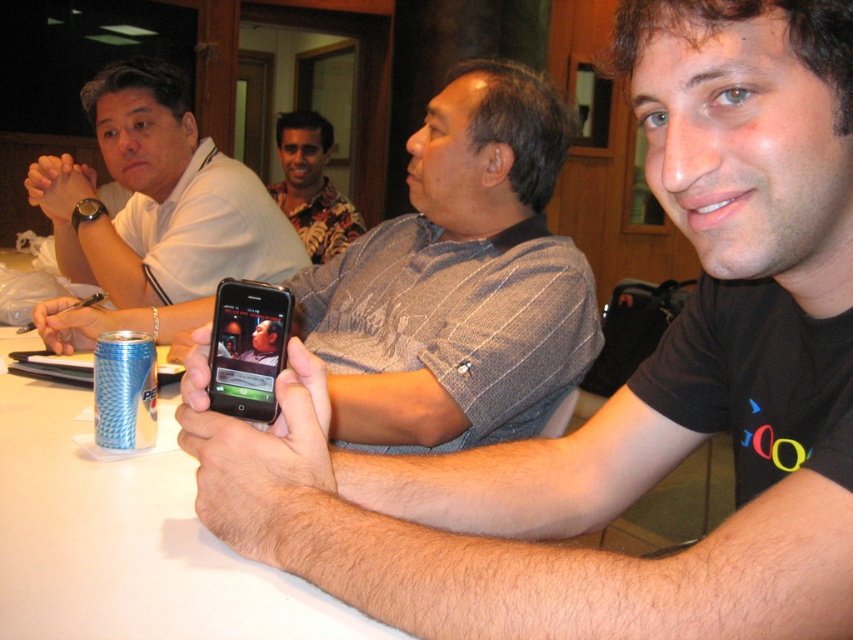
Question: Among these points, which one is farthest from the camera?

Choices:
 (A) (229, 355)
 (B) (148, 76)
 (C) (102, 384)
 (D) (422, 284)

Answer: (B)

Question: Can you confirm if matte black phone at center is positioned below floral shirt at center?

Choices:
 (A) yes
 (B) no

Answer: (A)

Question: Which of the following is the farthest from the observer?

Choices:
 (A) white matte shirt at upper left
 (B) matte black phone at center
 (C) floral shirt at center

Answer: (C)

Question: Is matte black phone at center above black glossy smartphone at center?

Choices:
 (A) yes
 (B) no

Answer: (A)

Question: Estimate the real-world distances between objects in this image. Which object is farther from the black glossy smartphone at center?

Choices:
 (A) blue textured can at lower left
 (B) floral shirt at center
 (C) matte black phone at center

Answer: (B)

Question: Can you confirm if white matte shirt at upper left is bigger than blue textured can at lower left?

Choices:
 (A) yes
 (B) no

Answer: (A)